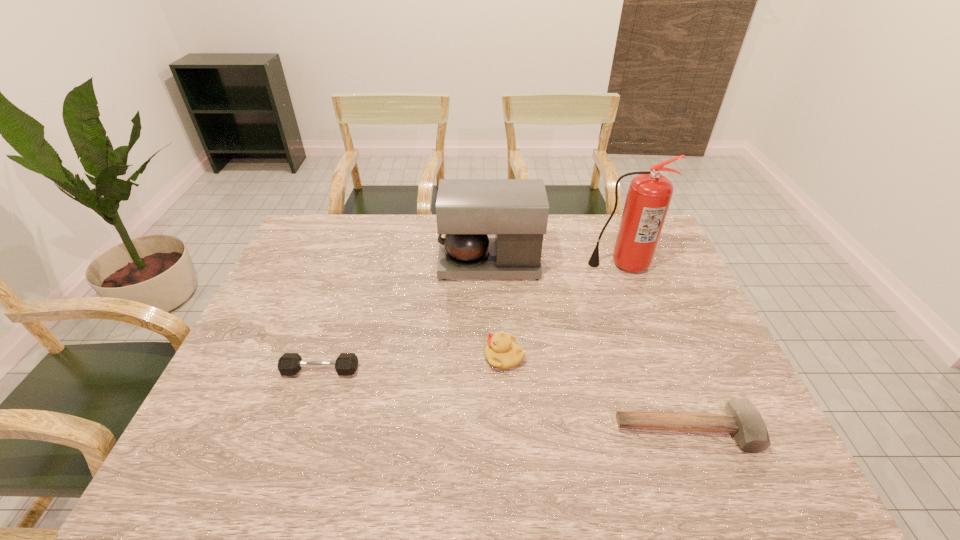
Locate an element on the screen. free space that is in between the duckling and the dumbbell is located at coordinates (413, 364).

Locate an element on the screen. free space between the nearest object and the coffee maker is located at coordinates (588, 348).

Where is `unoccupied position between the coffee maker and the tallest object`? The height and width of the screenshot is (540, 960). unoccupied position between the coffee maker and the tallest object is located at coordinates (556, 264).

Locate an element on the screen. The image size is (960, 540). vacant region between the third tallest object and the leftmost object is located at coordinates (413, 364).

Identify the location of free point between the fire extinguisher and the third tallest object. (563, 310).

You are a GUI agent. You are given a task and a screenshot of the screen. Output one action in this format:
    pyautogui.click(x=<x>, y=<y>)
    Task: Click on the unoccupied position between the duckling and the mallet
    Image resolution: width=960 pixels, height=540 pixels.
    Given the screenshot: What is the action you would take?
    pyautogui.click(x=595, y=394)

Identify the location of free spot between the leftmost object and the fire extinguisher. The height and width of the screenshot is (540, 960). (470, 318).

The height and width of the screenshot is (540, 960). I want to click on free space that is in between the dumbbell and the mallet, so click(504, 401).

The width and height of the screenshot is (960, 540). I want to click on object that is the closest one to the duckling, so click(x=742, y=419).

The height and width of the screenshot is (540, 960). I want to click on object that stands as the third closest to the second tallest object, so click(x=289, y=364).